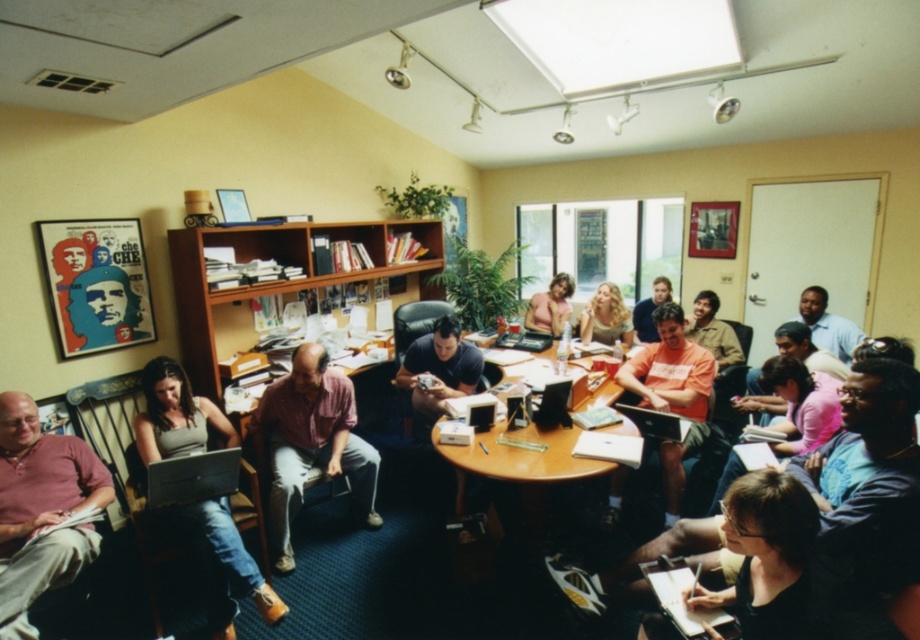
Question: Is pink cotton shirt at lower left behind light pink fabric shirt at center?

Choices:
 (A) yes
 (B) no

Answer: (B)

Question: Which of these objects is positioned farthest from the light pink fabric shirt at center?

Choices:
 (A) matte black shirt at center
 (B) orange cotton shirt at center

Answer: (A)

Question: Does matte black shirt at center appear on the left side of light pink fabric shirt at center?

Choices:
 (A) no
 (B) yes

Answer: (B)

Question: Which object is positioned closest to the orange cotton shirt at center?

Choices:
 (A) pink fabric shirt at center
 (B) light pink fabric shirt at center
 (C) wooden at center

Answer: (C)

Question: Which point appears farthest from the camera in this image?

Choices:
 (A) (1, 547)
 (B) (633, 310)

Answer: (B)

Question: Is wooden bookshelf at center above wooden at center?

Choices:
 (A) yes
 (B) no

Answer: (A)